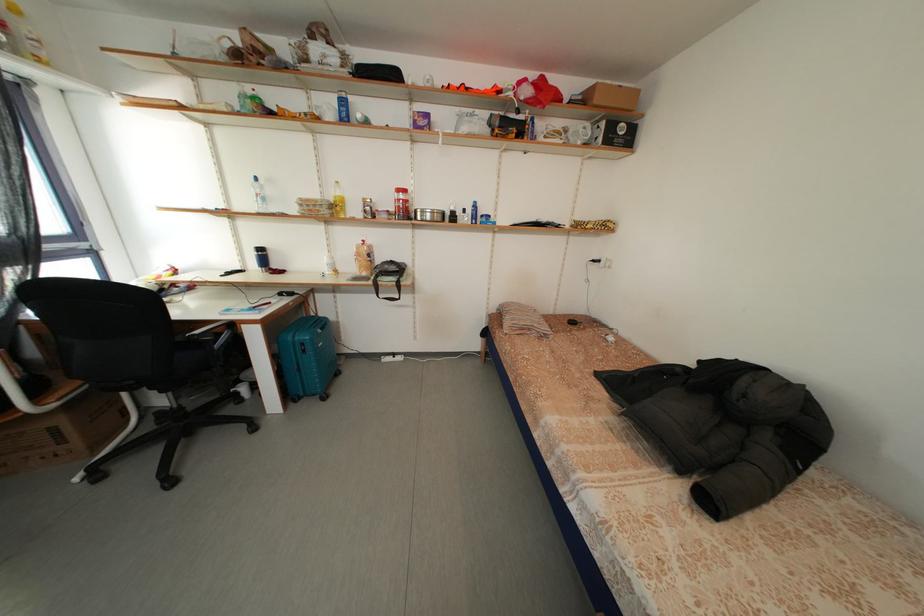
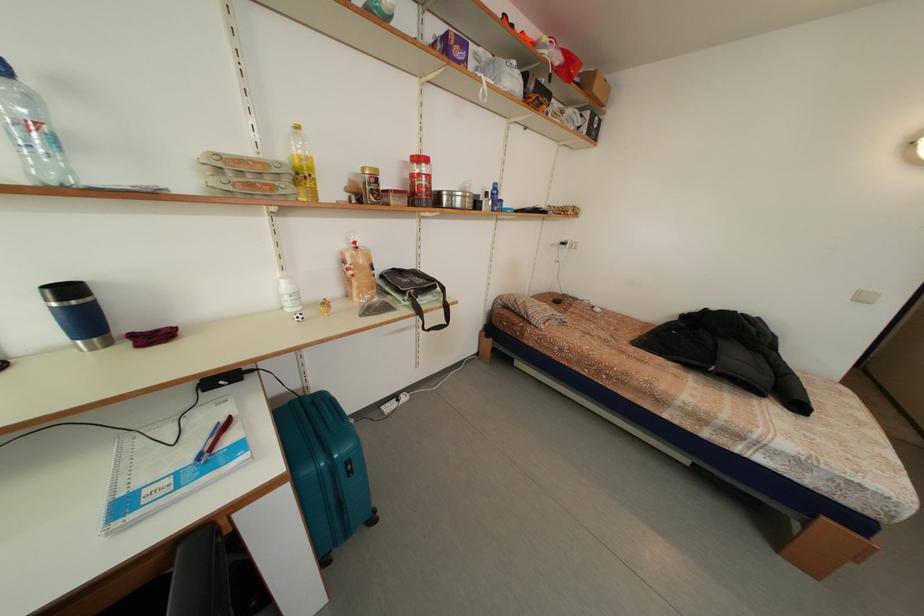
Locate, in the second image, the point that corresponds to pixel 435 121 in the first image.

(472, 51)